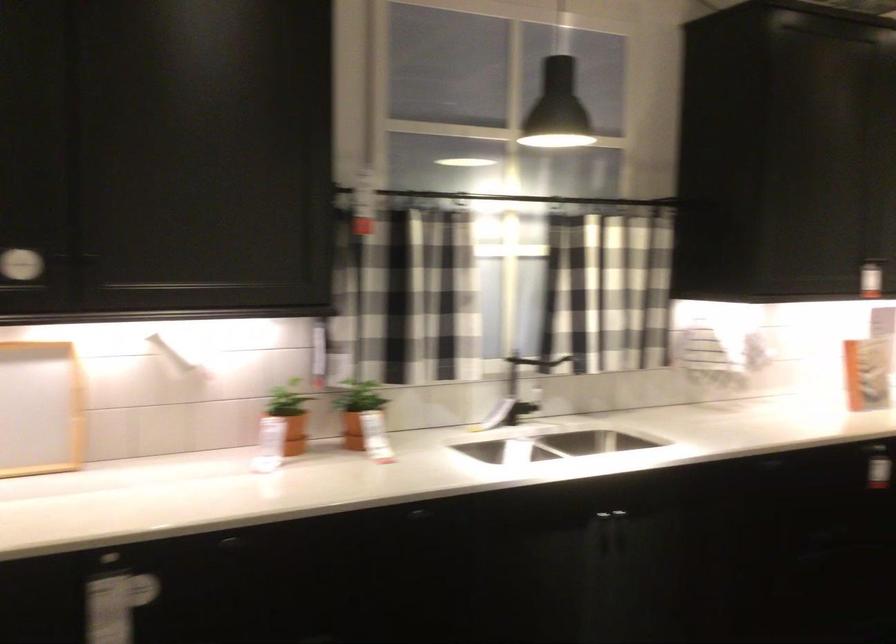
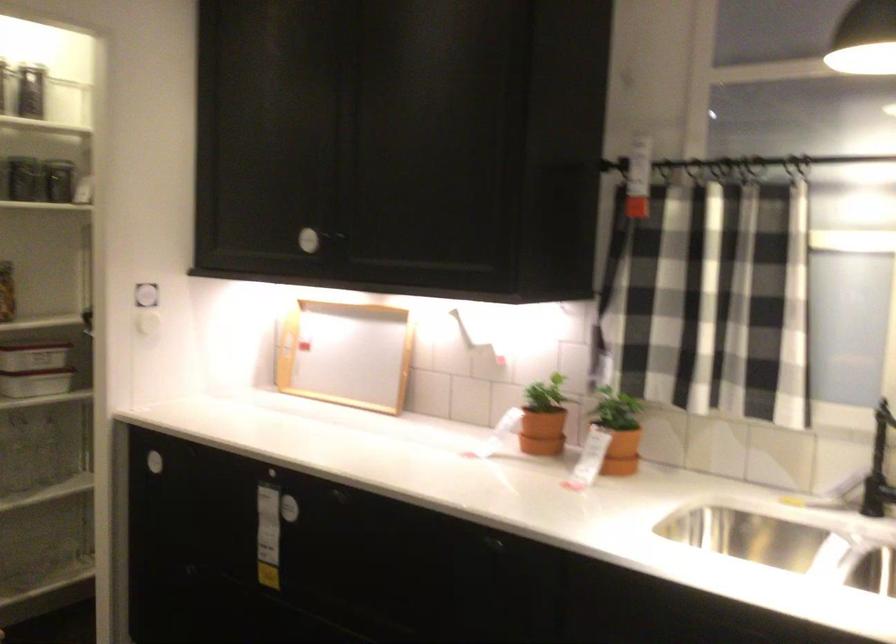
Locate, in the second image, the point that corresponds to [373,415] in the first image.

(617, 430)